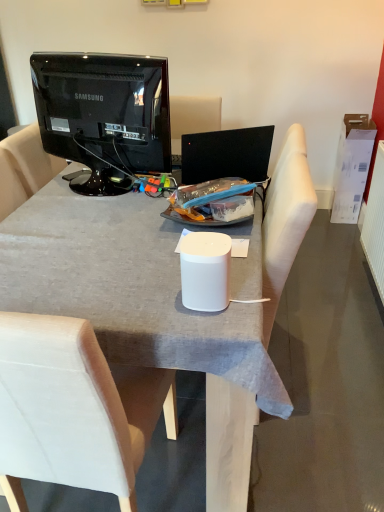
Question: Should I look upward or downward to see white matte desk at center?

Choices:
 (A) up
 (B) down

Answer: (B)

Question: Is white matte desk at center behind white fabric armchair at center?

Choices:
 (A) no
 (B) yes

Answer: (A)

Question: Is white matte desk at center with white fabric armchair at center?

Choices:
 (A) no
 (B) yes

Answer: (A)

Question: Considering the relative sizes of white matte desk at center and white fabric armchair at center in the image provided, is white matte desk at center smaller than white fabric armchair at center?

Choices:
 (A) yes
 (B) no

Answer: (B)

Question: From the image's perspective, is white matte desk at center on top of white fabric armchair at center?

Choices:
 (A) yes
 (B) no

Answer: (B)

Question: Is white matte desk at center thinner than white fabric armchair at center?

Choices:
 (A) no
 (B) yes

Answer: (A)

Question: Is white matte desk at center to the left of white fabric armchair at center from the viewer's perspective?

Choices:
 (A) yes
 (B) no

Answer: (A)

Question: Is white matte smart speaker at center at the left side of white fabric chair at center?

Choices:
 (A) yes
 (B) no

Answer: (B)

Question: Is white matte smart speaker at center to the right of white fabric chair at center from the viewer's perspective?

Choices:
 (A) yes
 (B) no

Answer: (A)

Question: Is white matte smart speaker at center positioned in front of white fabric chair at center?

Choices:
 (A) yes
 (B) no

Answer: (B)

Question: Is white fabric chair at center inside white matte smart speaker at center?

Choices:
 (A) no
 (B) yes

Answer: (A)

Question: Could you tell me if white matte smart speaker at center is turned towards white fabric chair at center?

Choices:
 (A) yes
 (B) no

Answer: (B)

Question: Is white matte smart speaker at center taller than white fabric chair at center?

Choices:
 (A) no
 (B) yes

Answer: (A)

Question: Is white fabric armchair at center turned away from white fabric chair at center?

Choices:
 (A) yes
 (B) no

Answer: (B)